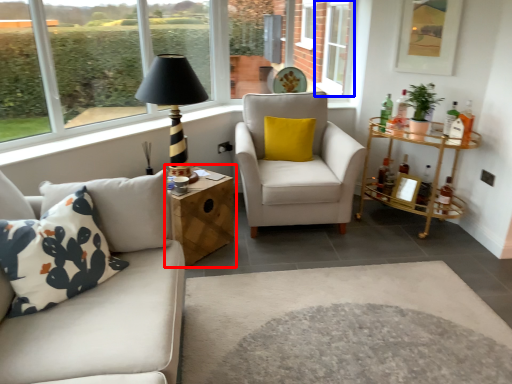
Question: Which of the following is the farthest to the observer, table (highlighted by a red box) or window (highlighted by a blue box)?

Choices:
 (A) table
 (B) window

Answer: (B)